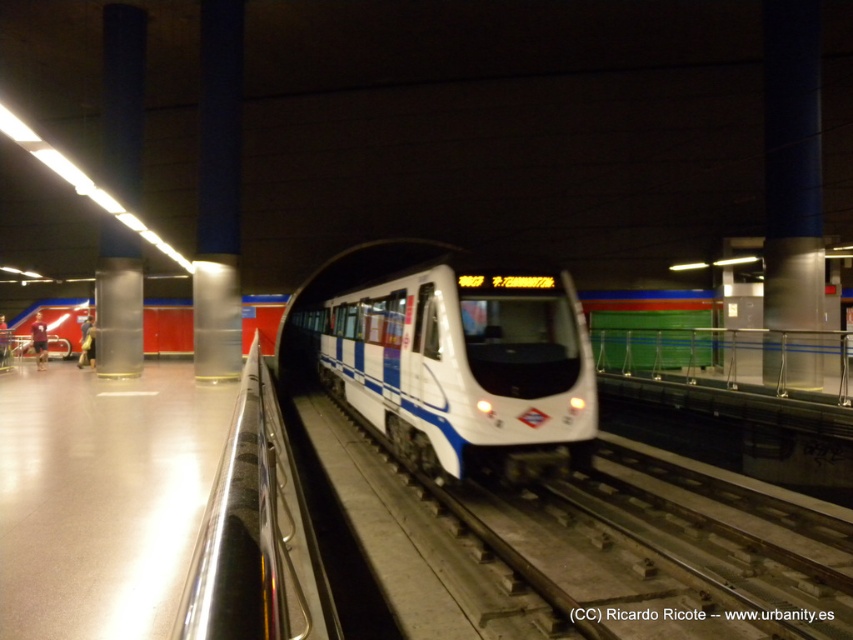
Who is positioned more to the right, white glossy passenger train at center or polished metal rail at center?

Positioned to the right is white glossy passenger train at center.

At what (x,y) coordinates should I click in order to perform the action: click on white glossy passenger train at center. Please return your answer as a coordinate pair (x, y). The height and width of the screenshot is (640, 853). Looking at the image, I should click on (457, 362).

Find the location of a particular element. The height and width of the screenshot is (640, 853). white glossy passenger train at center is located at coordinates (457, 362).

Where is `white glossy passenger train at center`? The image size is (853, 640). white glossy passenger train at center is located at coordinates (457, 362).